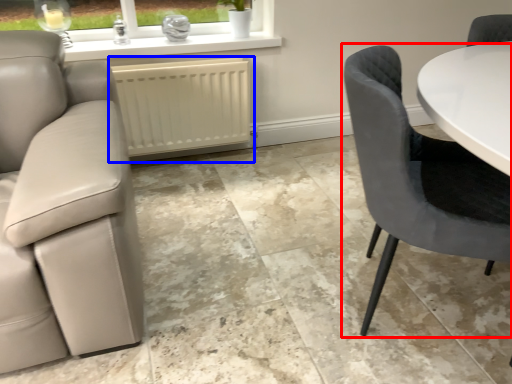
Question: Which object is further to the camera taking this photo, chair (highlighted by a red box) or radiator (highlighted by a blue box)?

Choices:
 (A) chair
 (B) radiator

Answer: (B)